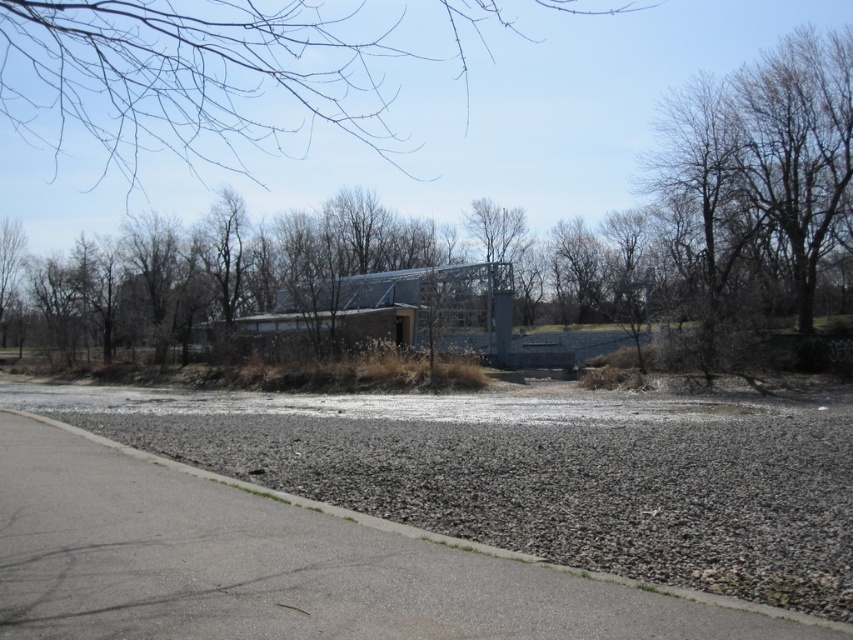
You are a hiker standing on the paved road and want to take a photo of the brown leafless tree at center and the bare branches at upper center. Which object should you focus on first if you want both to be in clear focus?

The brown leafless tree at center is located below the bare branches at upper center. Since the tree is closer to you than the branches, you should focus on the brown leafless tree at center first to ensure both are in clear focus.

You are a hiker planning to cross the gray gravel at lower right and the bare branches at upper center. Which path has a narrower width?

The gray gravel at lower right has a narrower width than the bare branches at upper center.